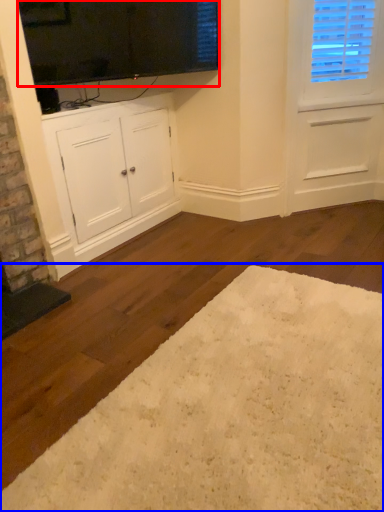
Question: Which object is closer to the camera taking this photo, window screen (highlighted by a red box) or plain (highlighted by a blue box)?

Choices:
 (A) window screen
 (B) plain

Answer: (B)